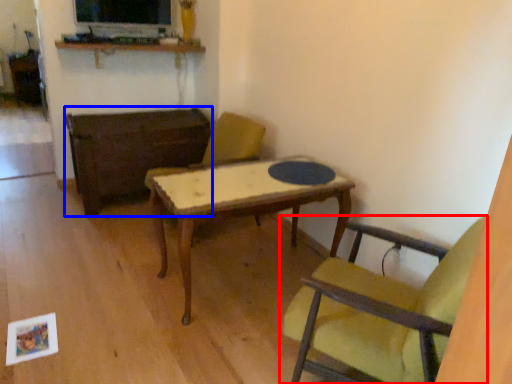
Question: Which point is closer to the camera, chair (highlighted by a red box) or table (highlighted by a blue box)?

Choices:
 (A) chair
 (B) table

Answer: (A)